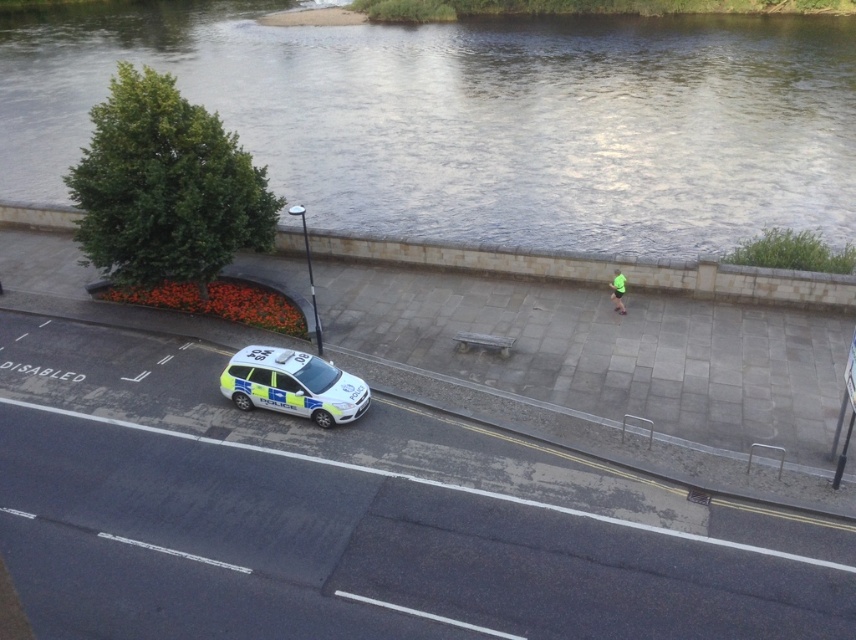
You are a pedestrian standing on the sidewalk. You see a white glossy police car at center and green fabric shorts at center. Which object is closer to you?

The white glossy police car at center is closer to you because it is in front of the green fabric shorts at center.

You are standing at the camera position looking at the street scene. There are two points marked in the image, one at coordinate point [336,422] and the other at point [623,307]. Which point is closer to you?

Point [336,422] is closer to the camera than point [623,307].

You are a pedestrian standing on the sidewalk to the right of the road. You want to cross to the clear water at upper center but need to walk around the white glossy police car at center. Which direction should you go relative to the police car to reach the water?

You should go to the left side of the white glossy police car at center to reach the clear water at upper center, since the clear water at upper center is located to the left of the police car.